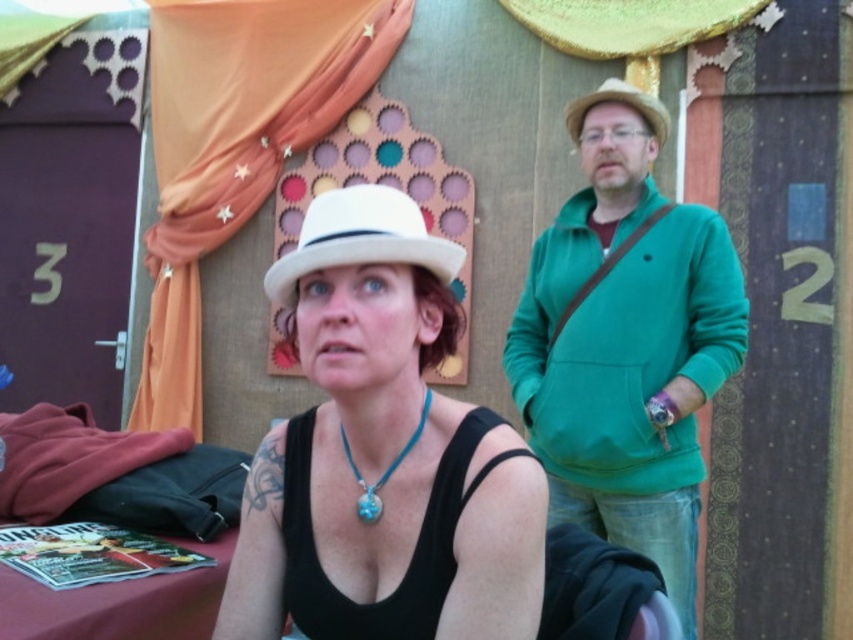
Describe the element at coordinates (625, 340) in the screenshot. This screenshot has height=640, width=853. I see `green matte sweater at right` at that location.

Looking at this image, between green matte sweater at right and turquoise stone pendant at center, which one appears on the right side from the viewer's perspective?

From the viewer's perspective, green matte sweater at right appears more on the right side.

This screenshot has width=853, height=640. What do you see at coordinates (625, 340) in the screenshot?
I see `green matte sweater at right` at bounding box center [625, 340].

At what (x,y) coordinates should I click in order to perform the action: click on green matte sweater at right. Please return your answer as a coordinate pair (x, y). Looking at the image, I should click on (625, 340).

Can you confirm if matte white hat at center is wider than light brown felt cowboy hat at upper right?

Indeed, matte white hat at center has a greater width compared to light brown felt cowboy hat at upper right.

Find the location of a particular element. matte white hat at center is located at coordinates (370, 376).

Is light brown felt cowboy hat at upper right shorter than turquoise stone pendant at center?

No.

Does point (657, 112) come farther from viewer compared to point (422, 428)?

Yes, it is.

Who is more distant from viewer, (581, 97) or (347, 444)?

Point (581, 97)

What are the coordinates of `light brown felt cowboy hat at upper right` in the screenshot? It's located at (621, 102).